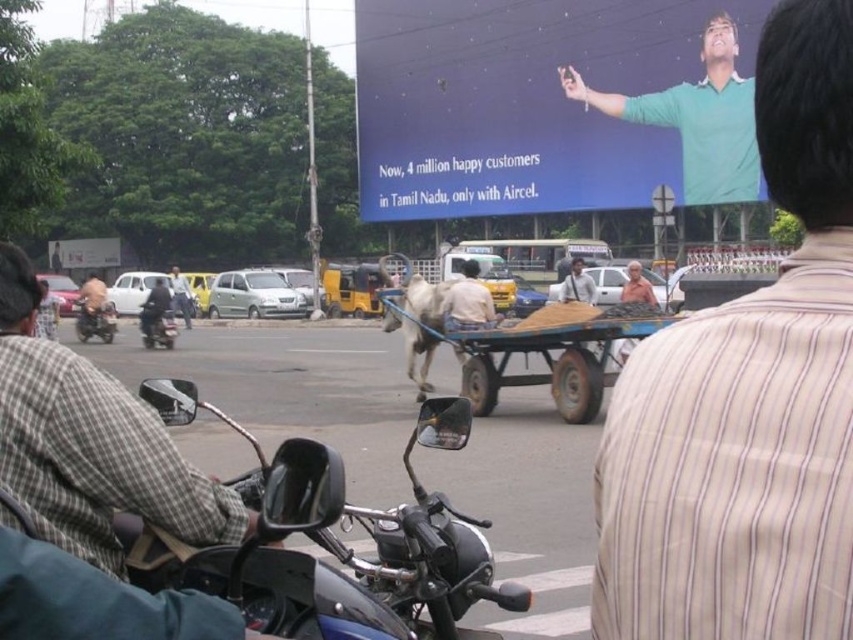
You are a delivery person trying to navigate through the street. You see the blue matte billboard at upper center and the light brown shirt at center. Which object is bigger in size?

The blue matte billboard at upper center is larger in size than the light brown shirt at center.

You are a delivery person who needs to attach a package to the light brown leather jacket at left. The package is as tall as the blue matte billboard at upper center. Will the package fit on the jacket?

The blue matte billboard at upper center is taller than the light brown leather jacket at left. Since the package is as tall as the billboard, it will not fit on the jacket because it is taller than the jacket itself.